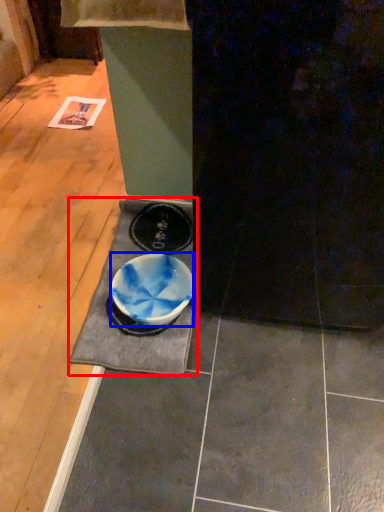
Question: Which object is closer to the camera taking this photo, doormat (highlighted by a red box) or bowl (highlighted by a blue box)?

Choices:
 (A) doormat
 (B) bowl

Answer: (A)